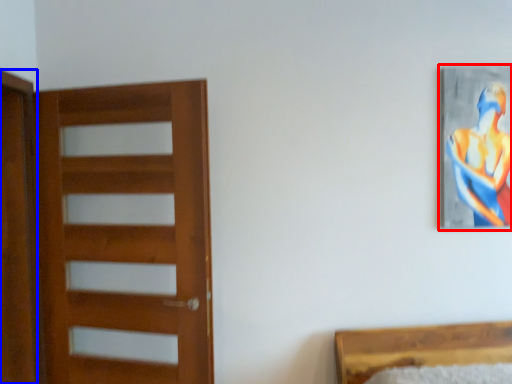
Question: Which of the following is the closest to the observer, picture frame (highlighted by a red box) or screen door (highlighted by a blue box)?

Choices:
 (A) picture frame
 (B) screen door

Answer: (B)